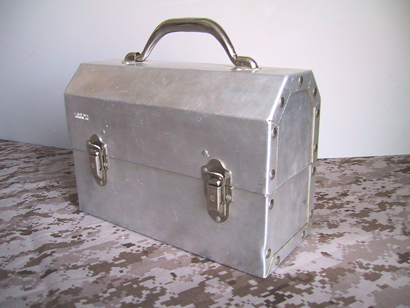
You are a GUI agent. You are given a task and a screenshot of the screen. Output one action in this format:
    pyautogui.click(x=<x>, y=<y>)
    Task: Click on the lock
    The image size is (410, 308).
    Given the screenshot: What is the action you would take?
    pyautogui.click(x=95, y=153)